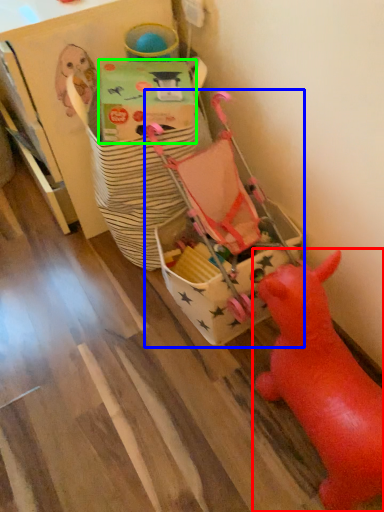
Question: Estimate the real-world distances between objects in this image. Which object is closer to toy (highlighted by a red box), toy (highlighted by a blue box) or cardboard box (highlighted by a green box)?

Choices:
 (A) toy
 (B) cardboard box

Answer: (A)